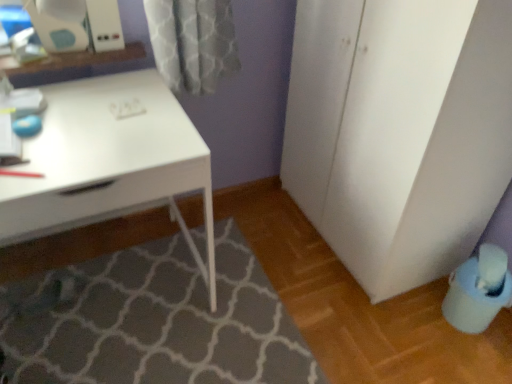
Where is `free space to the left of blue plastic swivel chair at lower right`? The width and height of the screenshot is (512, 384). free space to the left of blue plastic swivel chair at lower right is located at coordinates (421, 321).